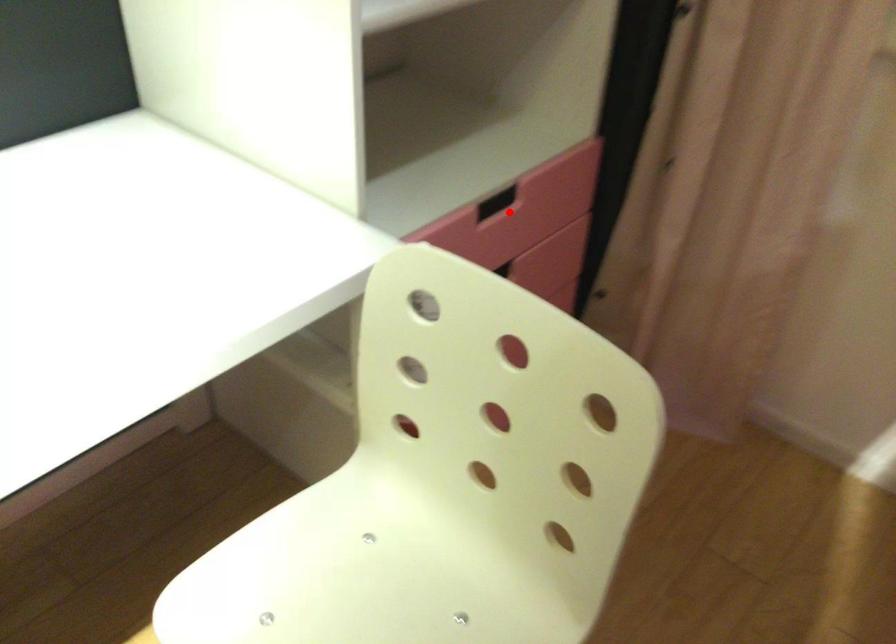
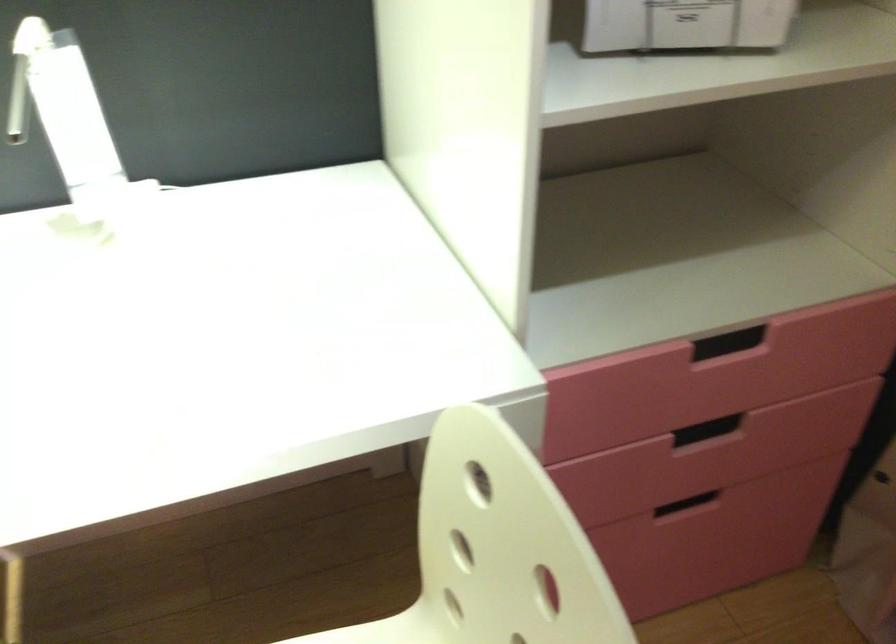
Where in the second image is the point corresponding to the highlighted location from the first image?

(743, 355)